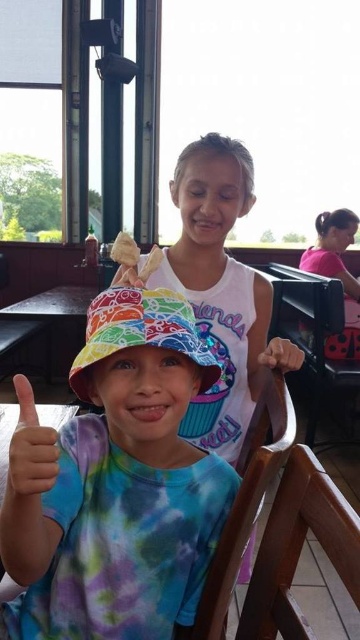
Measure the distance between point (270,378) and camera.

They are 39.37 inches apart.

Between wooden chair at center and golden crispy breadstick at center, which one is positioned higher?

Positioned higher is golden crispy breadstick at center.

Is point (235, 580) farther from viewer compared to point (151, 268)?

Yes, it is behind point (151, 268).

This screenshot has height=640, width=360. What are the coordinates of `wooden chair at center` in the screenshot? It's located at (245, 500).

Between point (151, 422) and point (147, 259), which one is positioned behind?

The point (147, 259) is more distant.

Where is `tie-dye fabric bucket hat at center`? tie-dye fabric bucket hat at center is located at coordinates (115, 483).

Is point (195, 362) positioned after point (150, 260)?

No, (195, 362) is in front of (150, 260).

Identify the location of tie-dye fabric bucket hat at center. The height and width of the screenshot is (640, 360). (115, 483).

Does black plastic chair at right have a smaller size compared to pink fabric shirt at right?

No.

Where is `black plastic chair at right`? The width and height of the screenshot is (360, 640). black plastic chair at right is located at coordinates (312, 332).